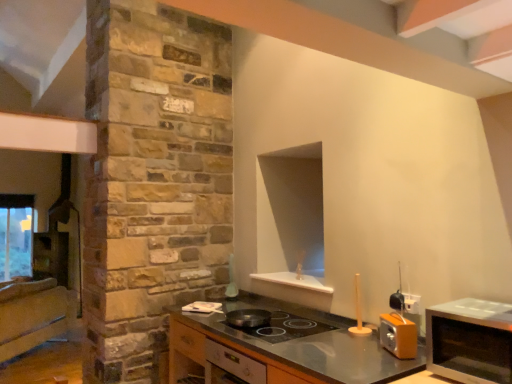
Question: Does point (39, 291) appear closer or farther from the camera than point (234, 362)?

Choices:
 (A) farther
 (B) closer

Answer: (A)

Question: In terms of size, does wooden cabinet at left, which ranks as the 1th cabinetry in back-to-front order, appear bigger or smaller than satin silver stove at center, acting as the first cabinetry starting from the right?

Choices:
 (A) big
 (B) small

Answer: (A)

Question: Which is nearer to the metallic gray countertop at center?

Choices:
 (A) satin silver stove at center, acting as the first cabinetry starting from the right
 (B) wooden cabinet at left, the 2th cabinetry viewed from the right
 (C) shiny black frying pan at center
 (D) satin silver microwave at right

Answer: (A)

Question: Based on their relative distances, which object is farther from the wooden cabinet at left, positioned as the first cabinetry in left-to-right order?

Choices:
 (A) shiny black frying pan at center
 (B) metallic gray countertop at center
 (C) satin silver microwave at right
 (D) satin silver stove at center, which ranks as the second cabinetry in back-to-front order

Answer: (C)